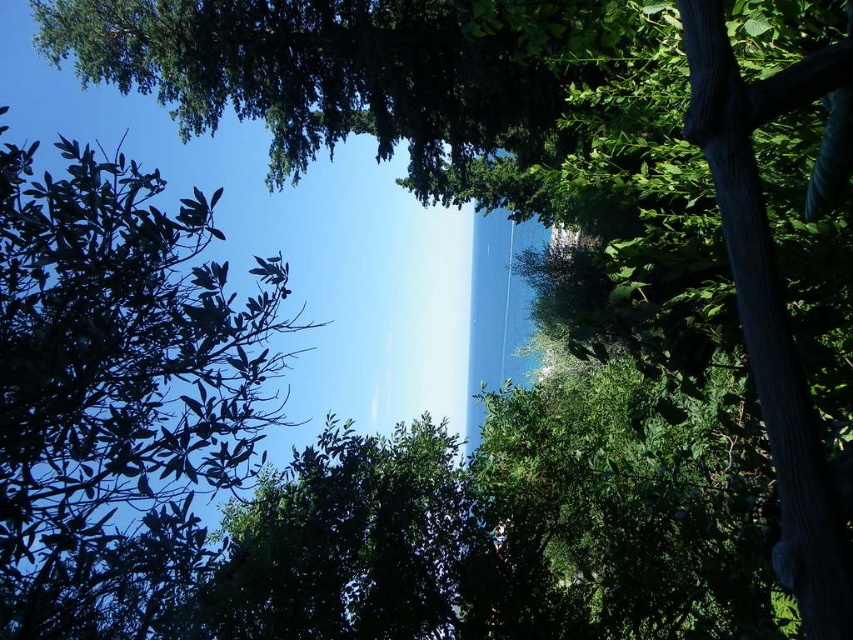
You are standing in a shaded forest area and see the green leafy tree at upper left and the green leafy tree at center. Which tree appears narrower?

The green leafy tree at upper left appears narrower than the green leafy tree at center because it has a lesser width.

You are standing in a shaded forest area and want to take a photo of the green leafy tree at upper left and the green leafy tree at center. Which tree is closer to the camera?

The green leafy tree at upper left is positioned over the green leafy tree at center, so it is closer to the camera.